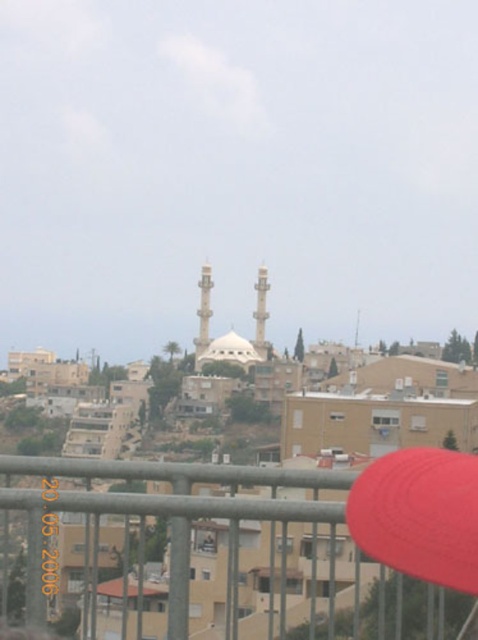
Which is behind, point (29, 513) or point (351, 538)?

Point (29, 513)

Who is higher up, metallic gray rail at lower center or red matte baseball hat at lower right?

red matte baseball hat at lower right

Is point (93, 508) more distant than point (469, 579)?

Yes, it is behind point (469, 579).

The width and height of the screenshot is (478, 640). Find the location of `metallic gray rail at lower center`. metallic gray rail at lower center is located at coordinates (225, 547).